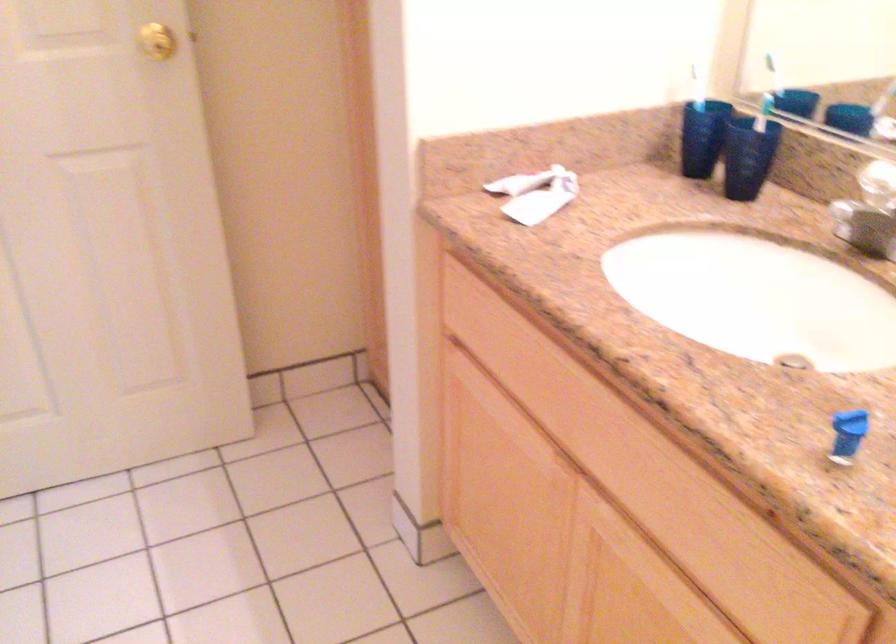
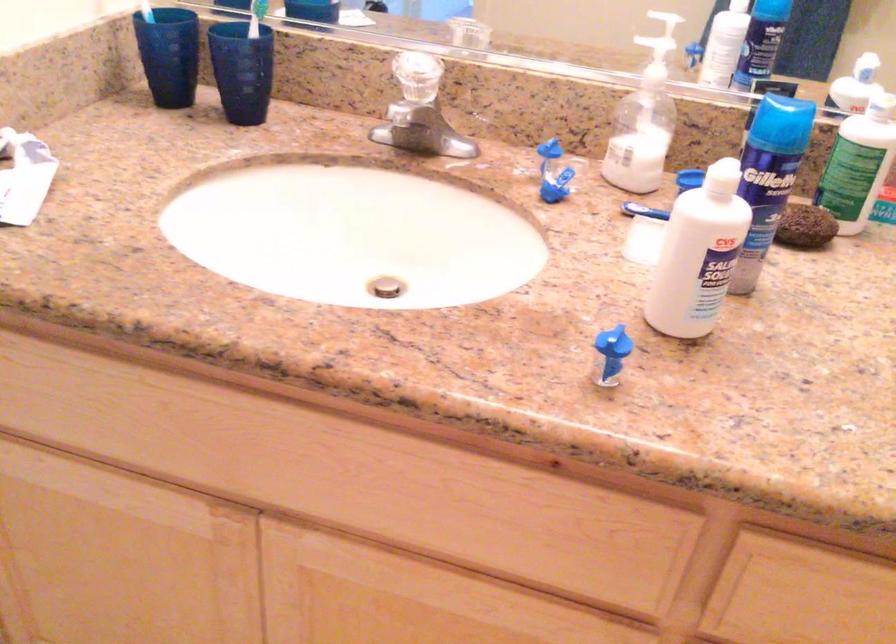
Locate, in the second image, the point that corresponds to point 757,113 in the first image.

(255, 17)